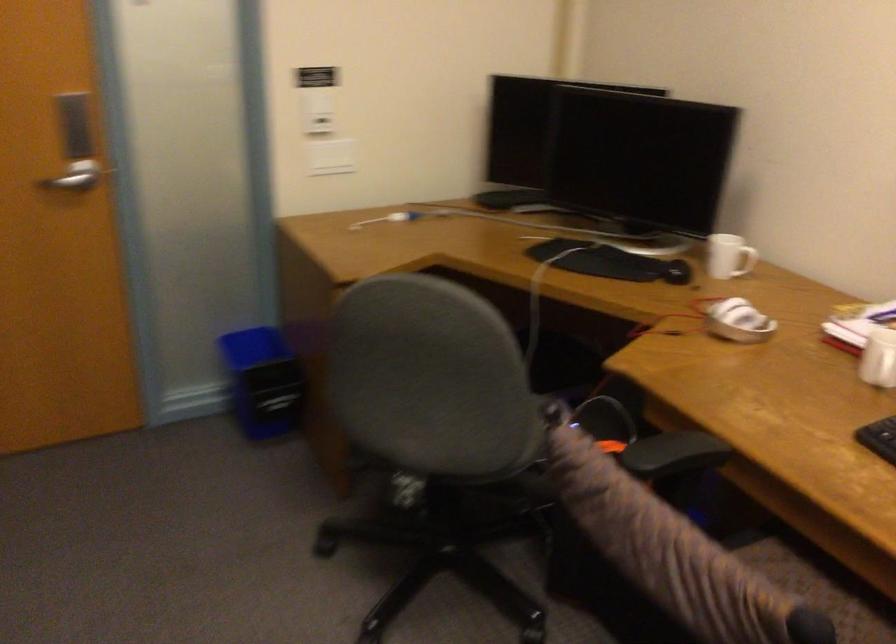
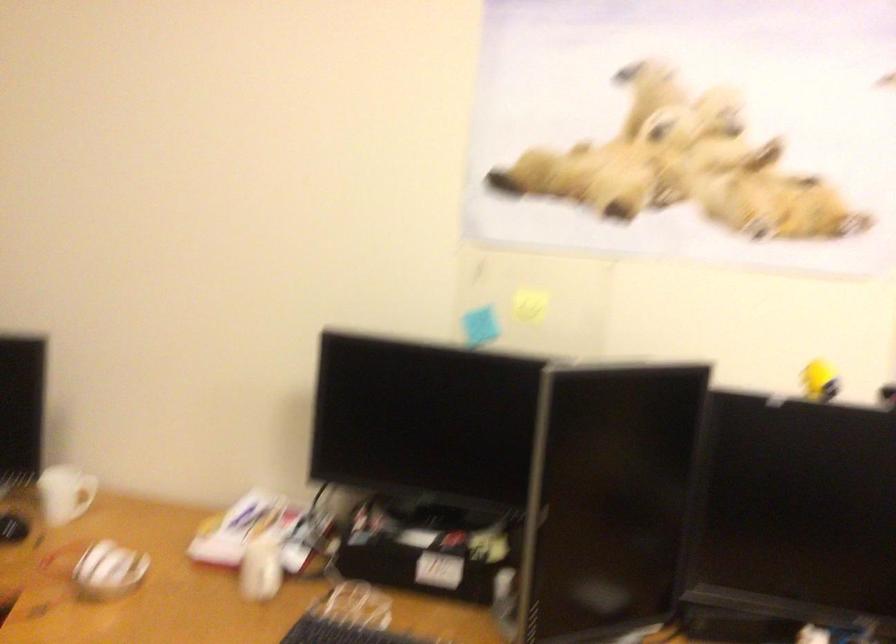
Question: The first image is from the beginning of the video and the second image is from the end. How did the camera likely rotate when shooting the video?

Choices:
 (A) Left
 (B) Right
 (C) Up
 (D) Down

Answer: (B)